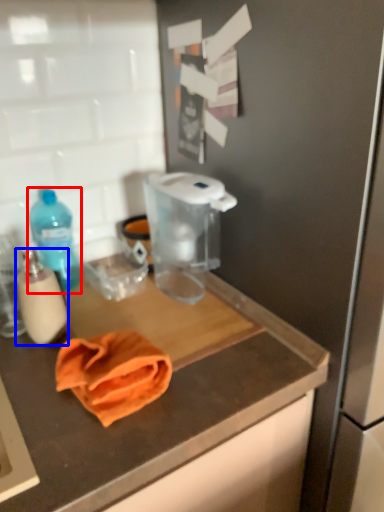
Question: Which object appears closest to the camera in this image, bottle (highlighted by a red box) or bottle (highlighted by a blue box)?

Choices:
 (A) bottle
 (B) bottle

Answer: (B)